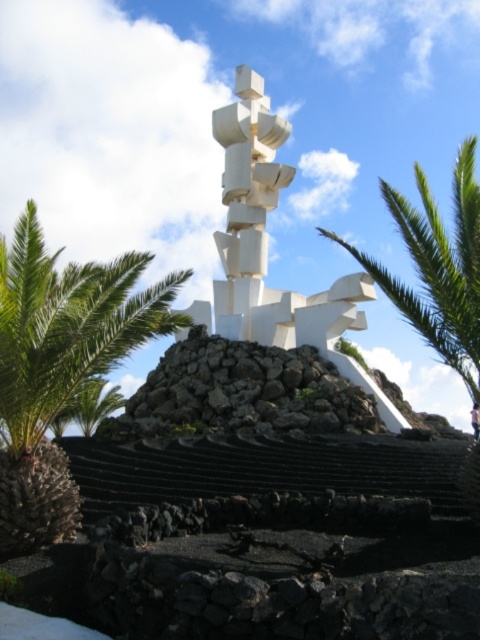
You are a visitor standing at the base of the sculpture and want to take a photo of both green leafy palm at center and green leafy palm at right. Which palm should you position closer to the camera to include both in the frame?

To include both green leafy palm at center and green leafy palm at right in the frame, you should position the green leafy palm at center closer to the camera since it is located below the green leafy palm at right, meaning it is farther away from the camera. By moving closer to the one that is farther away, you can capture both in the same shot.

From the picture: You are standing at the base of the sculpture and want to take a photo of the green leafy palm at center. Which direction should you face to capture it in your frame?

The green leafy palm at center is located at the center of the image, so you should face directly towards the sculpture to capture it in your frame.